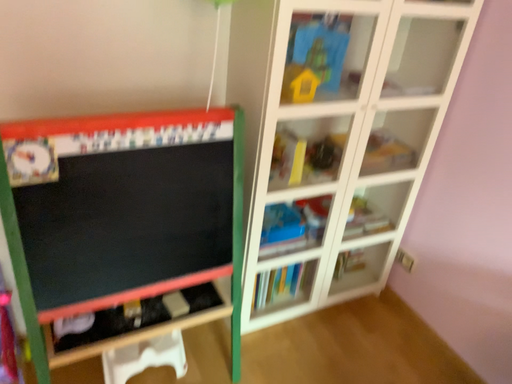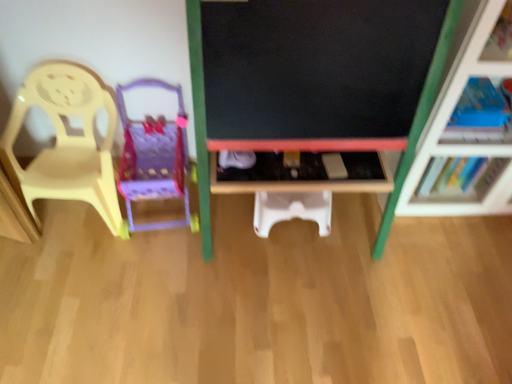
Question: Which way did the camera rotate in the video?

Choices:
 (A) rotated left
 (B) rotated right

Answer: (A)